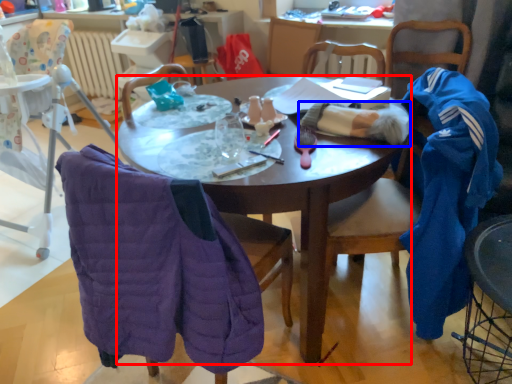
Question: Which object appears closest to the camera in this image, desk (highlighted by a red box) or clothing (highlighted by a blue box)?

Choices:
 (A) desk
 (B) clothing

Answer: (A)